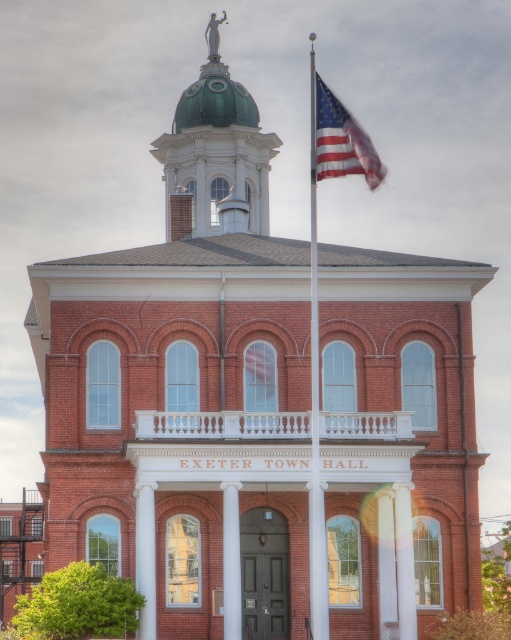
Is metallic silver flag pole at center to the left of american flag at upper right from the viewer's perspective?

Indeed, metallic silver flag pole at center is positioned on the left side of american flag at upper right.

Does metallic silver flag pole at center appear on the right side of american flag at upper right?

No, metallic silver flag pole at center is not to the right of american flag at upper right.

Does point (312, 68) come farther from viewer compared to point (356, 170)?

Yes, it is.

Find the location of a particular element. Image resolution: width=511 pixels, height=640 pixels. metallic silver flag pole at center is located at coordinates (315, 416).